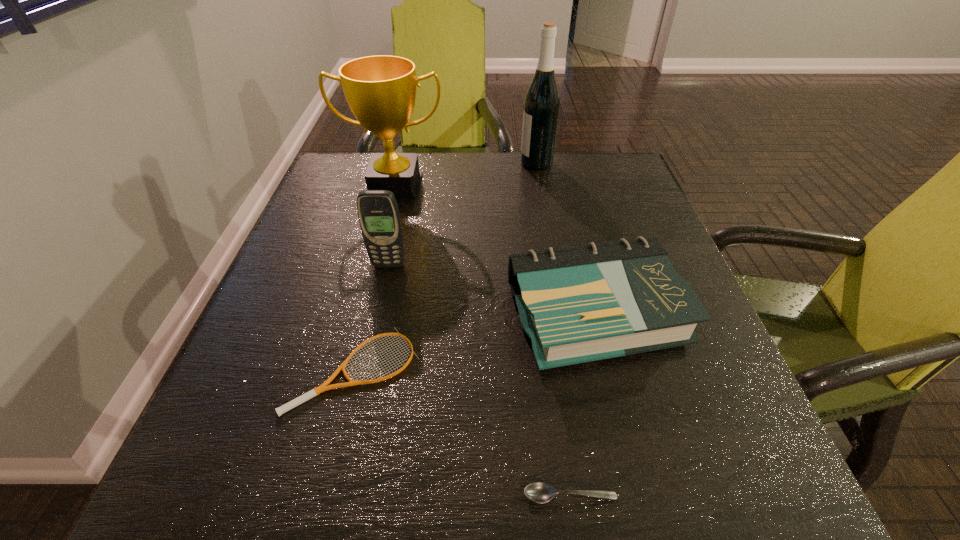
You are a GUI agent. You are given a task and a screenshot of the screen. Output one action in this format:
    pyautogui.click(x=<x>, y=<y>)
    Task: Click on the wine bottle
    The image size is (960, 540).
    Given the screenshot: What is the action you would take?
    pyautogui.click(x=542, y=101)

The image size is (960, 540). What are the coordinates of `the fifth shortest object` in the screenshot? It's located at click(380, 90).

Where is `cellular telephone`? This screenshot has height=540, width=960. cellular telephone is located at coordinates (378, 212).

Identify the location of paperback book. (579, 304).

Identify the location of tennis racket. The height and width of the screenshot is (540, 960). (323, 387).

This screenshot has width=960, height=540. Find the location of `soupspoon`. soupspoon is located at coordinates (539, 492).

The width and height of the screenshot is (960, 540). Find the location of `blank space located 0.360m on the label of the tallest object`. blank space located 0.360m on the label of the tallest object is located at coordinates (389, 163).

Find the location of a particular element. The height and width of the screenshot is (540, 960). vacant space located on the label of the tallest object is located at coordinates (480, 163).

At what (x,y) coordinates should I click in order to perform the action: click on vacant area located 0.260m on the label of the tallest object. Please return your answer as a coordinate pair (x, y). The width and height of the screenshot is (960, 540). Looking at the image, I should click on 425,163.

Where is `free space located 0.250m on the front-facing side of the fifth shortest object`? free space located 0.250m on the front-facing side of the fifth shortest object is located at coordinates coord(372,275).